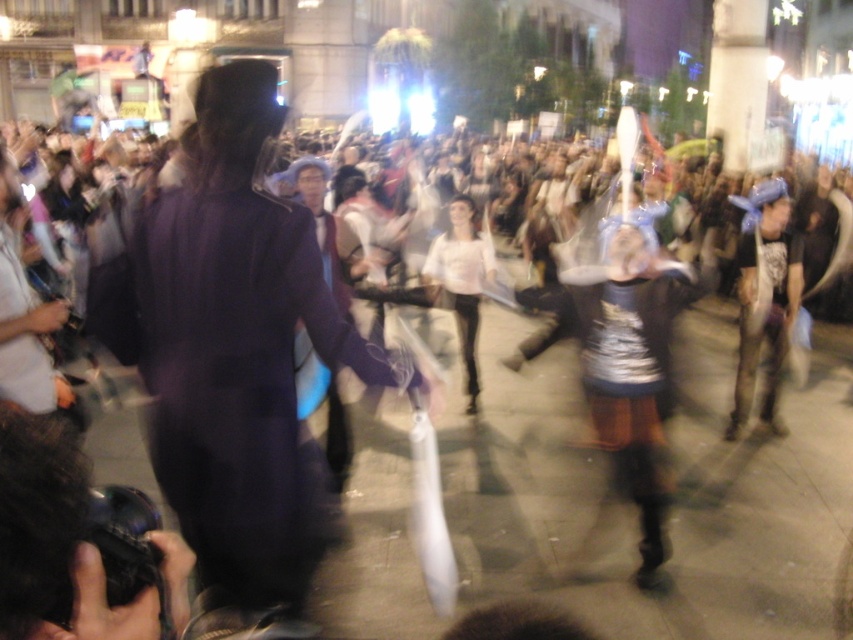
You are a photographer trying to capture the scene. You notice the purple fabric coat at left and the white matte dress at center. Which of these two items is positioned closer to the front of the crowd?

The purple fabric coat at left is closer to the viewer than the white matte dress at center, so the purple fabric coat at left is positioned closer to the front of the crowd.

You are standing in the crowd at the event and want to locate the purple fabric coat at left. According to the coordinates provided, where exactly is it positioned?

The purple fabric coat at left is located at point 0.561 on the horizontal axis and 0.281 on the vertical axis.